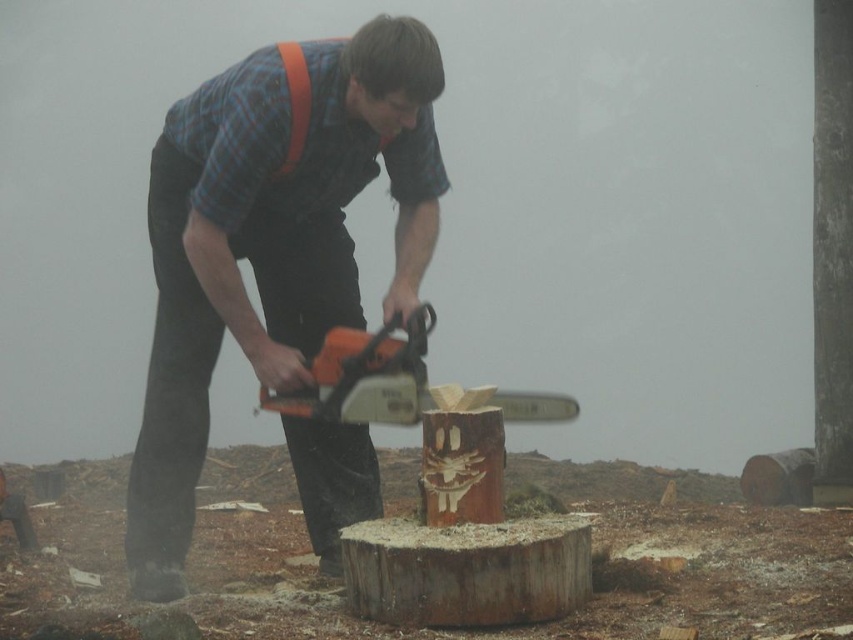
Question: Which point appears farthest from the camera in this image?

Choices:
 (A) (300, 99)
 (B) (158, 236)
 (C) (514, 550)
 (D) (332, 403)

Answer: (B)

Question: Does orange plastic chainsaw at center appear over orange fabric suspenders at upper center?

Choices:
 (A) yes
 (B) no

Answer: (B)

Question: Can you confirm if rustic wood carving at center is positioned to the left of orange plastic chainsaw at center?

Choices:
 (A) yes
 (B) no

Answer: (B)

Question: Which point is closer to the camera?

Choices:
 (A) orange plastic chainsaw at center
 (B) orange fabric suspenders at upper center
 (C) rustic wood carving at center

Answer: (C)

Question: Which of the following is the closest to the observer?

Choices:
 (A) (200, 314)
 (B) (527, 609)

Answer: (B)

Question: Does orange plastic chainsaw at center appear on the right side of orange fabric suspenders at upper center?

Choices:
 (A) yes
 (B) no

Answer: (A)